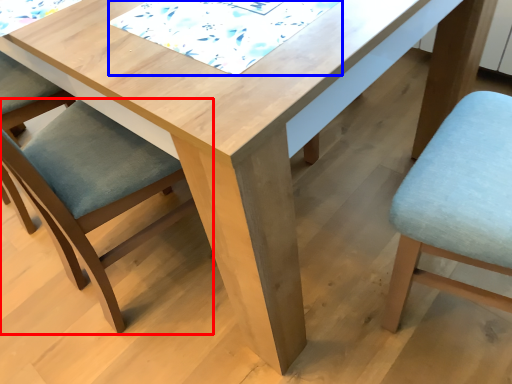
Question: Which object appears farthest to the camera in this image, chair (highlighted by a red box) or quilt (highlighted by a blue box)?

Choices:
 (A) chair
 (B) quilt

Answer: (B)